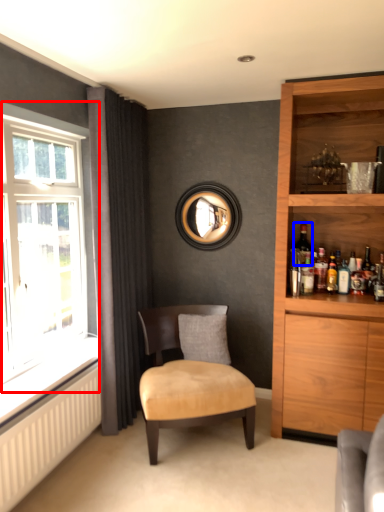
Question: Which of the following is the farthest to the observer, window (highlighted by a red box) or wine bottle (highlighted by a blue box)?

Choices:
 (A) window
 (B) wine bottle

Answer: (B)